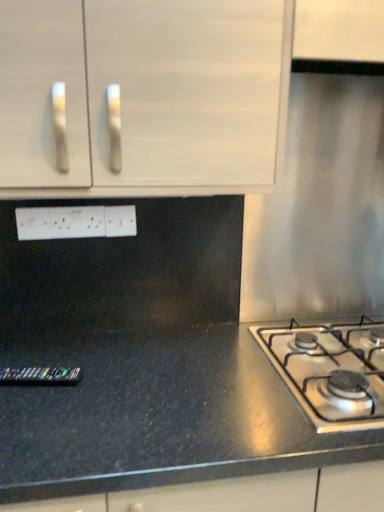
Question: Is black granite countertop at lower left surrounded by white plastic electrical outlet at center, which is the 2th electric outlet from right to left?

Choices:
 (A) yes
 (B) no

Answer: (B)

Question: Is white plastic electrical outlet at center, which is the 2th electric outlet from right to left, aimed at black granite countertop at lower left?

Choices:
 (A) no
 (B) yes

Answer: (A)

Question: From a real-world perspective, does white plastic electrical outlet at center, which is the 2th electric outlet from right to left, sit lower than black granite countertop at lower left?

Choices:
 (A) no
 (B) yes

Answer: (A)

Question: From the image's perspective, is white plastic electrical outlet at center, marked as the first electric outlet in a left-to-right arrangement, above black granite countertop at lower left?

Choices:
 (A) no
 (B) yes

Answer: (B)

Question: From a real-world perspective, is white plastic electrical outlet at center, which is the 2th electric outlet from right to left, on black granite countertop at lower left?

Choices:
 (A) yes
 (B) no

Answer: (A)

Question: From the image's perspective, relative to satin silver gas stove at lower right, is white matte cabinet at upper left above or below?

Choices:
 (A) above
 (B) below

Answer: (A)

Question: In terms of width, does white matte cabinet at upper left look wider or thinner when compared to satin silver gas stove at lower right?

Choices:
 (A) wide
 (B) thin

Answer: (B)

Question: Is white matte cabinet at upper left in front of or behind satin silver gas stove at lower right in the image?

Choices:
 (A) behind
 (B) front

Answer: (B)

Question: Looking at the image, does white matte cabinet at upper left seem bigger or smaller compared to satin silver gas stove at lower right?

Choices:
 (A) big
 (B) small

Answer: (A)

Question: From a real-world perspective, is black granite countertop at lower left physically located above or below white matte cabinet at upper left?

Choices:
 (A) above
 (B) below

Answer: (B)

Question: In the image, is black granite countertop at lower left on the left side or the right side of white matte cabinet at upper left?

Choices:
 (A) right
 (B) left

Answer: (A)

Question: Does point (226, 474) appear closer or farther from the camera than point (183, 26)?

Choices:
 (A) farther
 (B) closer

Answer: (B)

Question: Is black granite countertop at lower left inside or outside of white matte cabinet at upper left?

Choices:
 (A) outside
 (B) inside

Answer: (A)

Question: Considering the positions of black granite countertop at lower left and white plastic electrical outlet at center, marked as the first electric outlet in a left-to-right arrangement, in the image, is black granite countertop at lower left wider or thinner than white plastic electrical outlet at center, marked as the first electric outlet in a left-to-right arrangement,?

Choices:
 (A) thin
 (B) wide

Answer: (B)

Question: Is black granite countertop at lower left inside or outside of white plastic electrical outlet at center, marked as the first electric outlet in a left-to-right arrangement?

Choices:
 (A) outside
 (B) inside

Answer: (A)